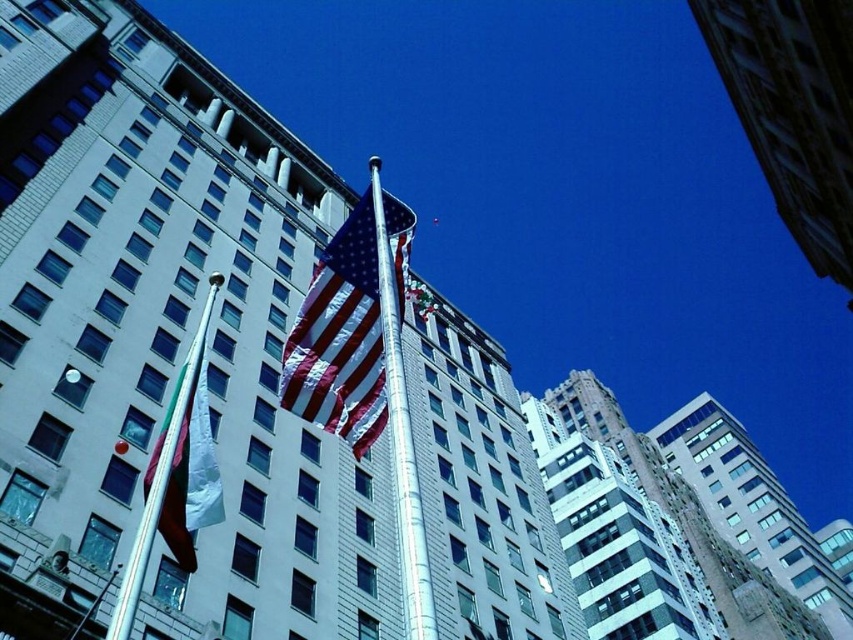
You are a city planner assessing the urban space in front of the building. You need to install a new bench that is 1.2 meters wide. The bench must be placed between the polished silver pole at center and the white fabric flag at left. Based on the space between these two objects, will the bench fit comfortably?

The polished silver pole at center has a lesser width compared to white fabric flag at left, but the description does not provide the distance between them. Therefore, it is impossible to determine if the bench will fit comfortably.

You are standing in front of the building and want to walk towards the silver metallic flag pole at upper center and the polished silver pole at center. Which pole will you reach first?

You will reach the silver metallic flag pole at upper center first because it is closer to you than the polished silver pole at center, which is further away.

You are a photographer standing in front of the building. You want to take a picture that includes both the polished silver pole at center and the white fabric flag at left. Which object should you position closer to the front of your camera frame to ensure both are in focus?

To ensure both the polished silver pole at center and the white fabric flag at left are in focus, position the polished silver pole at center closer to the front of your camera frame since it is nearer to the viewer compared to the white fabric flag at left. This arrangement helps maintain depth of field for both subjects.